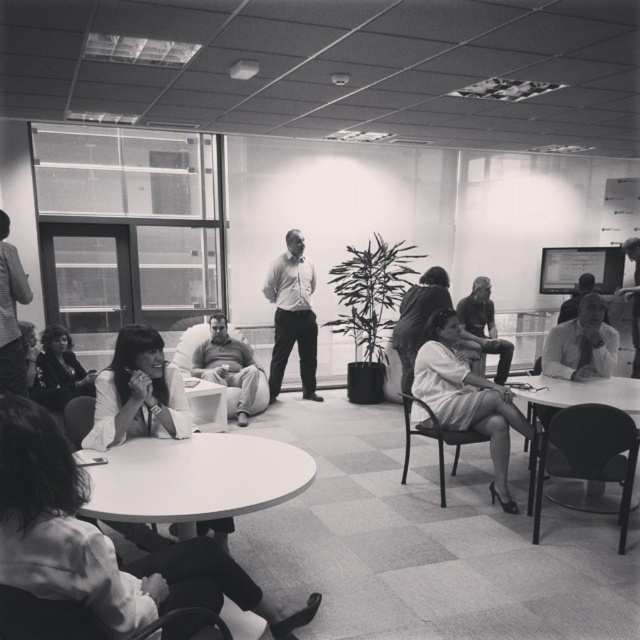
You are an office worker who needs to place a document on the smooth white table at center. However, there is a smooth white shirt at right in the way. Can you move the document to the table without disturbing the shirt?

The smooth white table at center is positioned on the left side of the smooth white shirt at right, so you can move the document to the table by placing it to the left of the shirt without disturbing it.

You are an office worker who needs to choose between the metallic silver chair at center and the smooth plastic chair at lower left for a meeting. Which chair offers more seating space?

The metallic silver chair at center is larger in size than the smooth plastic chair at lower left, so it offers more seating space.

From the picture: You are standing at the entrance of the office and want to approach the smooth white shirt at center. According to the image, in which direction should you move to reach it?

The smooth white shirt at center is located at point (634, 300), which is near the bottom center of the image. Since you are at the entrance, you should move forward towards the center of the room to reach it.